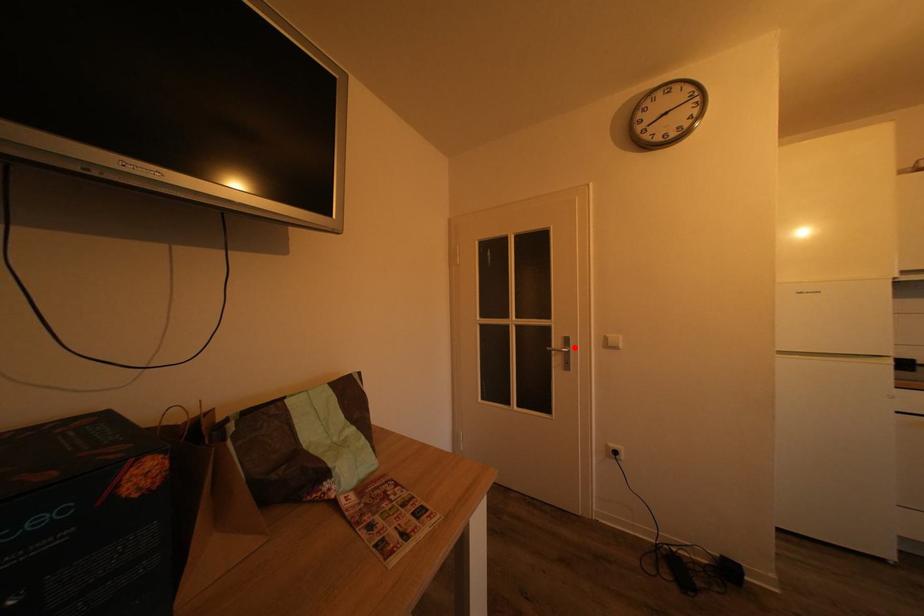
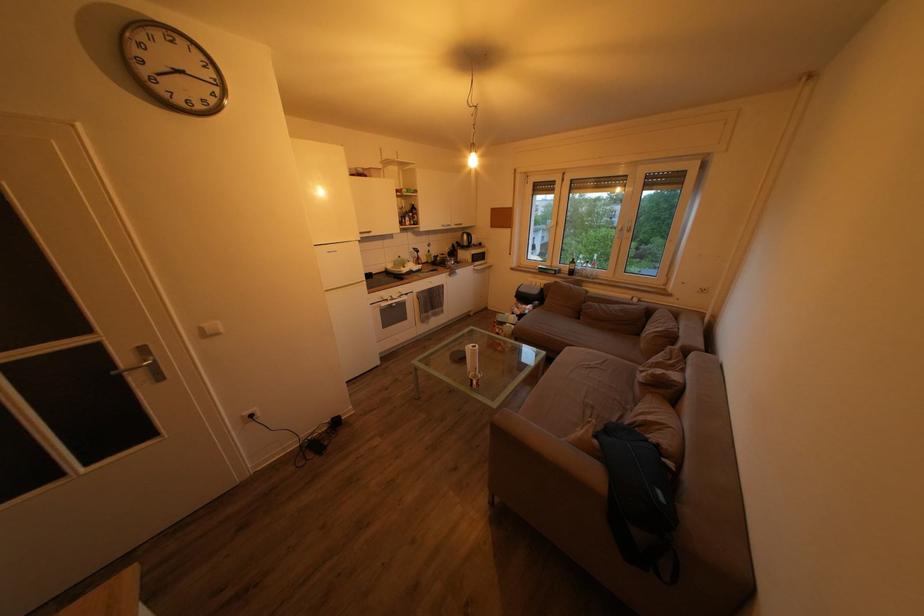
Find the pixel in the second image that matches the highlighted location in the first image.

(151, 357)